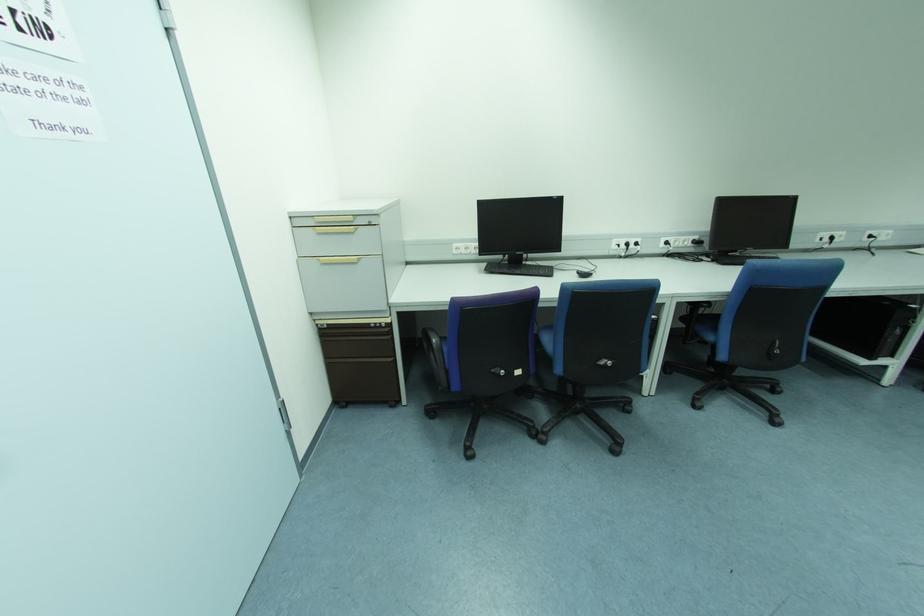
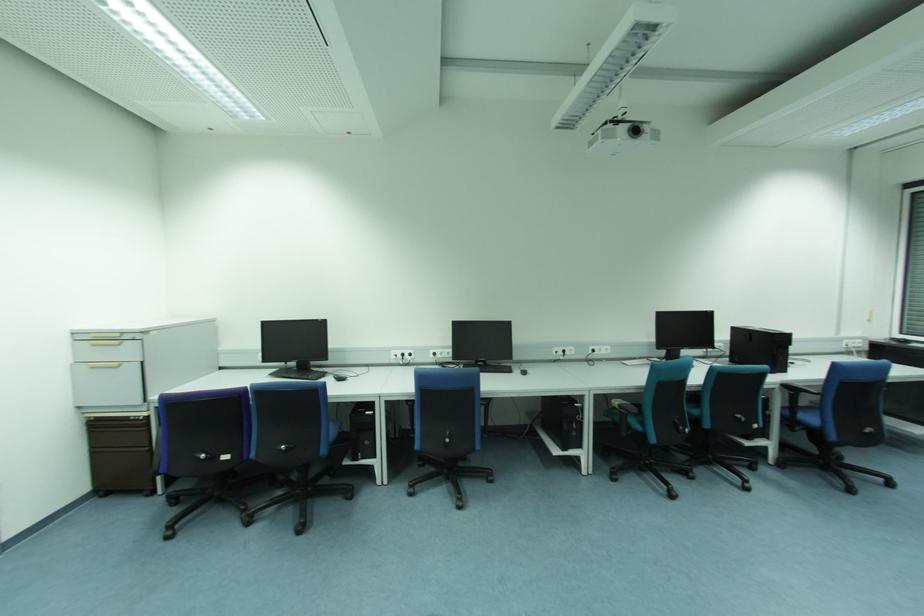
The images are taken continuously from a first-person perspective. In which direction are you moving?

The cameraman moved toward right, backward.